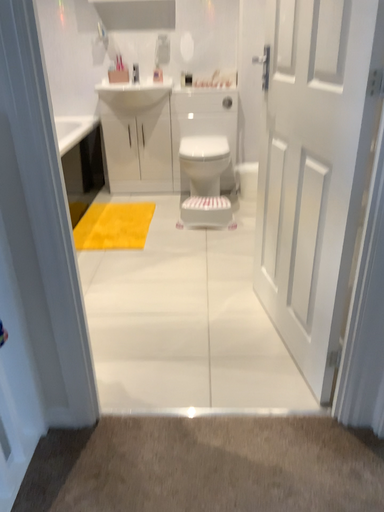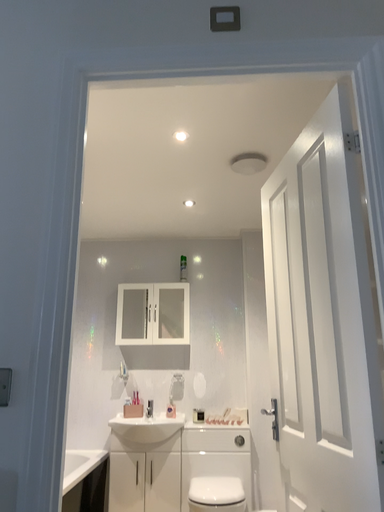
Question: How did the camera likely rotate when shooting the video?

Choices:
 (A) rotated upward
 (B) rotated downward

Answer: (A)